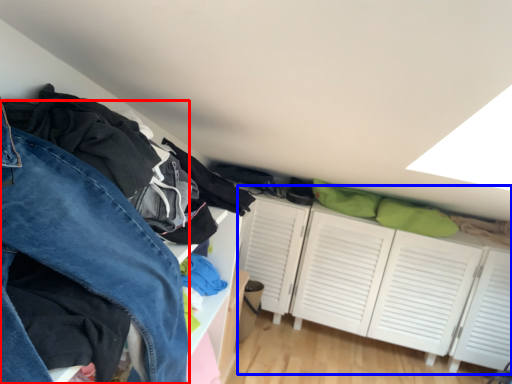
Question: Which of the following is the closest to the observer, trousers (highlighted by a red box) or dresser (highlighted by a blue box)?

Choices:
 (A) trousers
 (B) dresser

Answer: (A)